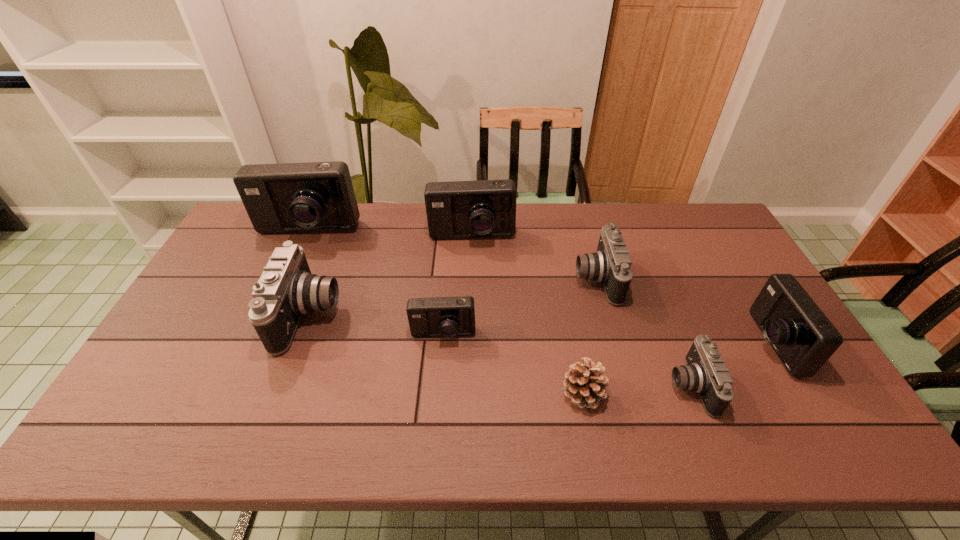
Identify the location of the second camera from right to left. Image resolution: width=960 pixels, height=540 pixels. (706, 374).

Find the location of `the seventh object from left to right`. the seventh object from left to right is located at coordinates (706, 374).

At what (x,y) coordinates should I click in order to perform the action: click on blank space located on the front-facing side of the leftmost blue camera. Please return your answer as a coordinate pair (x, y). The image size is (960, 540). Looking at the image, I should click on 292,266.

Locate an element on the screen. The width and height of the screenshot is (960, 540). vacant area situated on the front-facing side of the third smallest blue camera is located at coordinates (469, 318).

The height and width of the screenshot is (540, 960). I want to click on free space located 0.210m on the front-facing side of the leftmost black camera, so click(412, 315).

Where is `vacant point located on the front-facing side of the rightmost object`? This screenshot has width=960, height=540. vacant point located on the front-facing side of the rightmost object is located at coordinates (704, 343).

Identify the location of vacant space located on the front-facing side of the rightmost object. The height and width of the screenshot is (540, 960). (715, 343).

What are the coordinates of `vacant region located 0.050m on the front-facing side of the rightmost object` in the screenshot? It's located at (733, 343).

Locate an element on the screen. Image resolution: width=960 pixels, height=540 pixels. vacant space located 0.390m on the front-facing side of the second black camera from left to right is located at coordinates coord(450,279).

Locate an element on the screen. This screenshot has width=960, height=540. free space located 0.200m on the front-facing side of the second black camera from left to right is located at coordinates (511, 279).